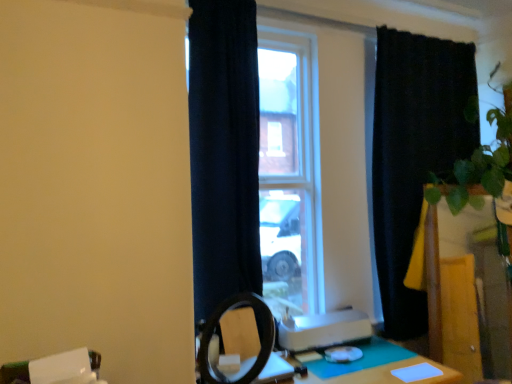
The width and height of the screenshot is (512, 384). I want to click on free spot above green felt table at lower right (from a real-world perspective), so click(x=354, y=362).